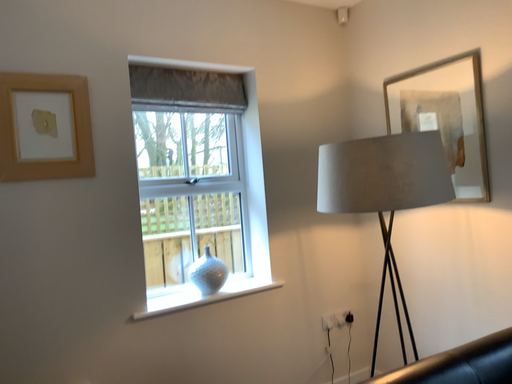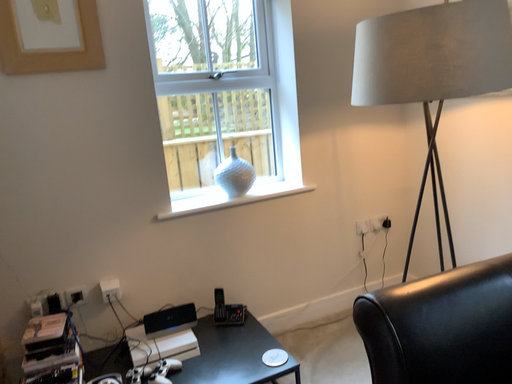
Question: How did the camera likely rotate when shooting the video?

Choices:
 (A) rotated left
 (B) rotated right

Answer: (A)